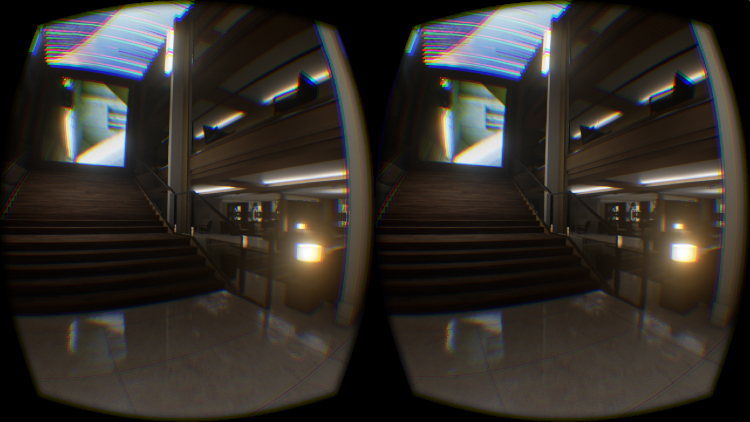
The width and height of the screenshot is (750, 422). Find the location of `reflective surface`. reflective surface is located at coordinates (603, 350).